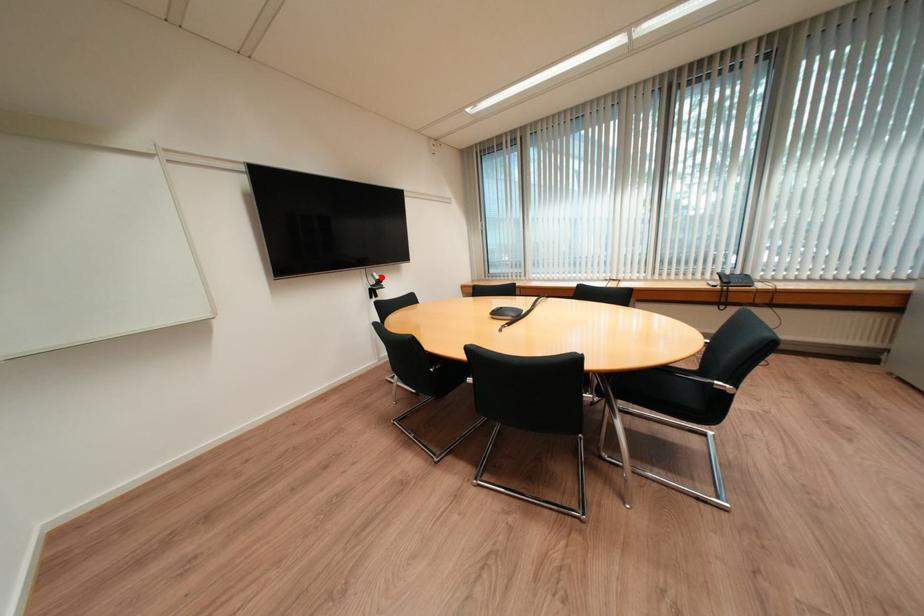
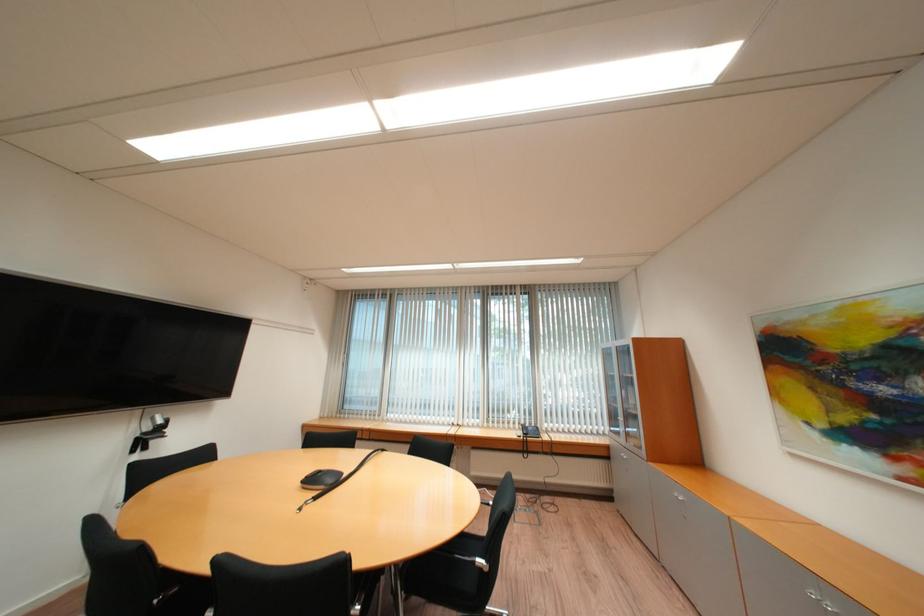
In the second image, find the point that corresponds to the highlighted location in the first image.

(162, 419)